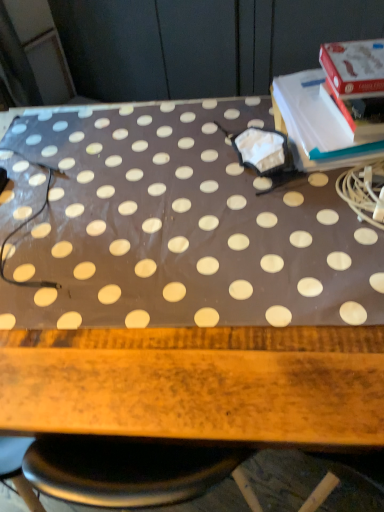
In order to click on blank space situated above white polka dot fabric at center (from a real-world perspective) in this screenshot , I will do `click(187, 225)`.